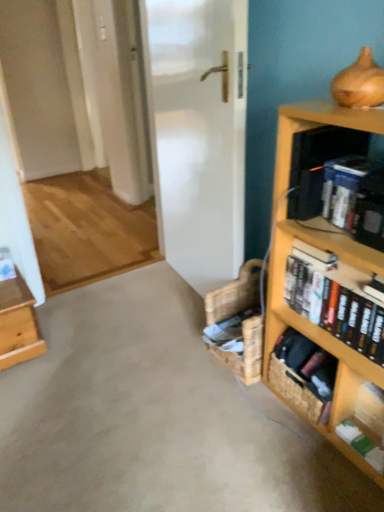
Find the location of a particular element. free point to the right of light brown wooden table at left is located at coordinates (79, 336).